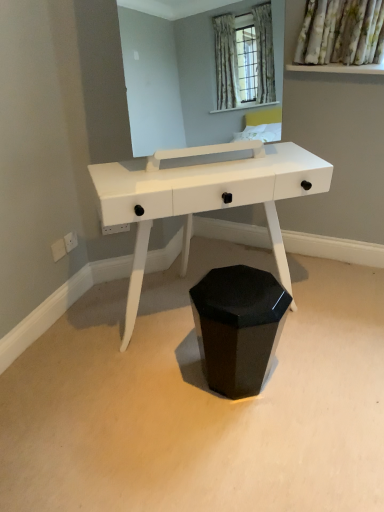
The image size is (384, 512). Identify the location of free location in front of black glossy hexagonal waste bin at center. (248, 441).